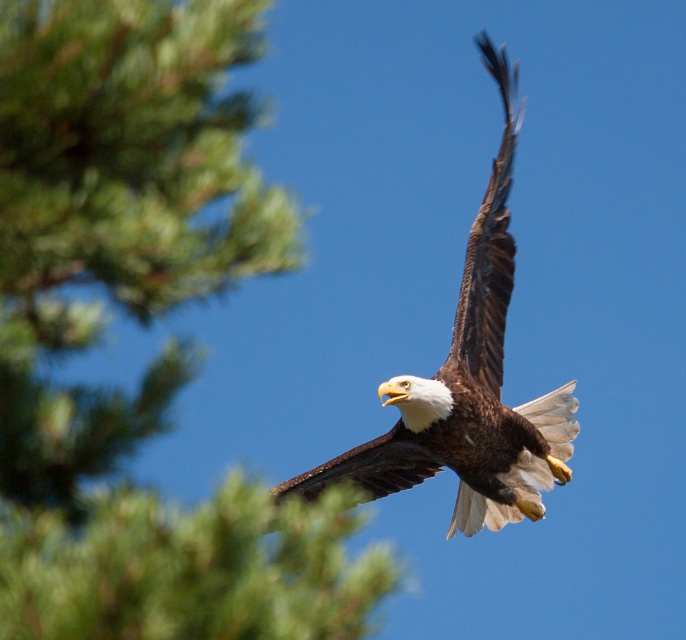
Question: In this image, where is green textured pine tree at upper left located relative to brown feathered eagle at center?

Choices:
 (A) left
 (B) right

Answer: (A)

Question: Can you confirm if green textured pine tree at upper left is positioned below brown feathered eagle at center?

Choices:
 (A) yes
 (B) no

Answer: (A)

Question: Which of the following is the closest to the observer?

Choices:
 (A) brown feathered eagle at center
 (B) green textured pine tree at upper left

Answer: (B)

Question: Which object appears closest to the camera in this image?

Choices:
 (A) green textured pine tree at upper left
 (B) brown feathered eagle at center

Answer: (A)

Question: Is green textured pine tree at upper left below brown feathered eagle at center?

Choices:
 (A) yes
 (B) no

Answer: (A)

Question: Which point is closer to the camera taking this photo?

Choices:
 (A) (552, 449)
 (B) (222, 275)

Answer: (B)